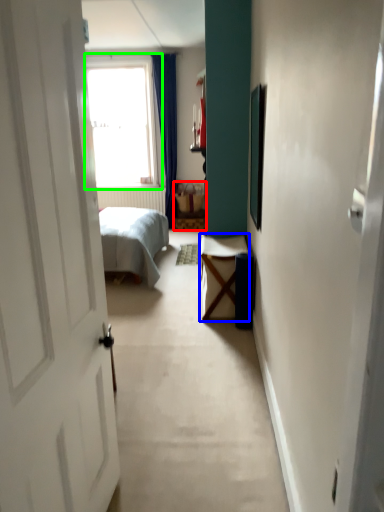
Question: Which object is positioned farthest from furniture (highlighted by a red box)? Select from table (highlighted by a blue box) and window (highlighted by a green box).

Choices:
 (A) table
 (B) window

Answer: (A)